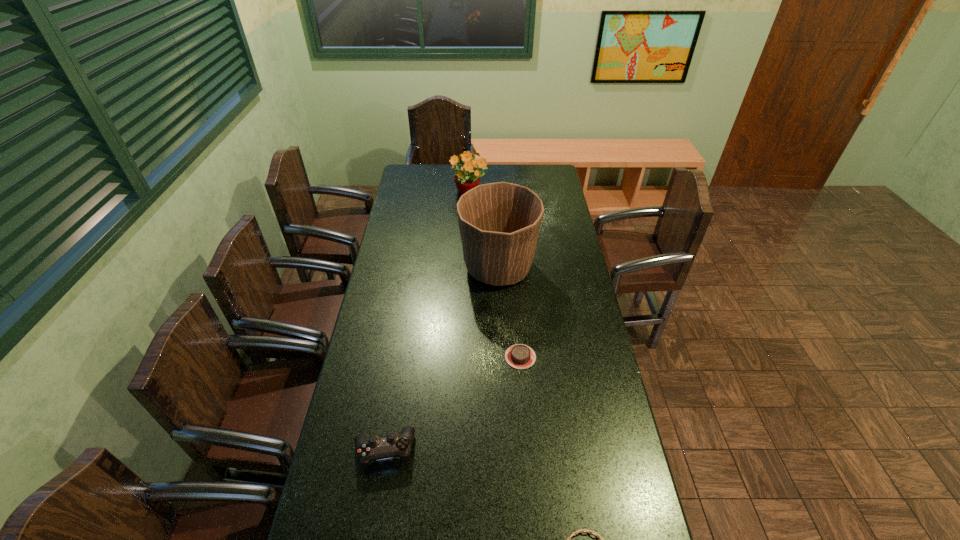
Locate an element on the screen. The width and height of the screenshot is (960, 540). the fourth nearest object is located at coordinates (499, 223).

You are a GUI agent. You are given a task and a screenshot of the screen. Output one action in this format:
    pyautogui.click(x=<x>, y=<y>)
    Task: Click on the taller flowerpot
    
    Given the screenshot: What is the action you would take?
    pyautogui.click(x=499, y=223)

The height and width of the screenshot is (540, 960). In order to click on the shorter flowerpot in this screenshot , I will do `click(469, 176)`.

The height and width of the screenshot is (540, 960). In order to click on the farther flowerpot in this screenshot , I will do `click(469, 176)`.

Image resolution: width=960 pixels, height=540 pixels. I want to click on the second nearest object, so click(x=374, y=448).

Where is `the third tallest object`? the third tallest object is located at coordinates (374, 448).

Locate an element on the screen. The width and height of the screenshot is (960, 540). the second shortest object is located at coordinates (520, 356).

Locate an element on the screen. This screenshot has width=960, height=540. chocolate cake is located at coordinates (520, 356).

Where is `vacant area situated on the back of the nearer flowerpot`? This screenshot has height=540, width=960. vacant area situated on the back of the nearer flowerpot is located at coordinates (496, 224).

Identify the location of vacant space located on the front of the farther flowerpot. Image resolution: width=960 pixels, height=540 pixels. (x=468, y=247).